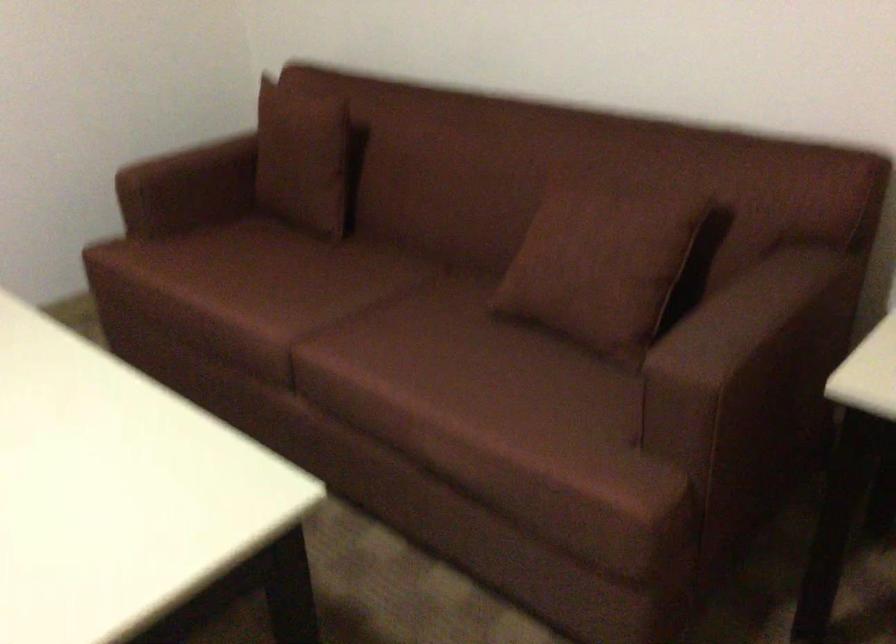
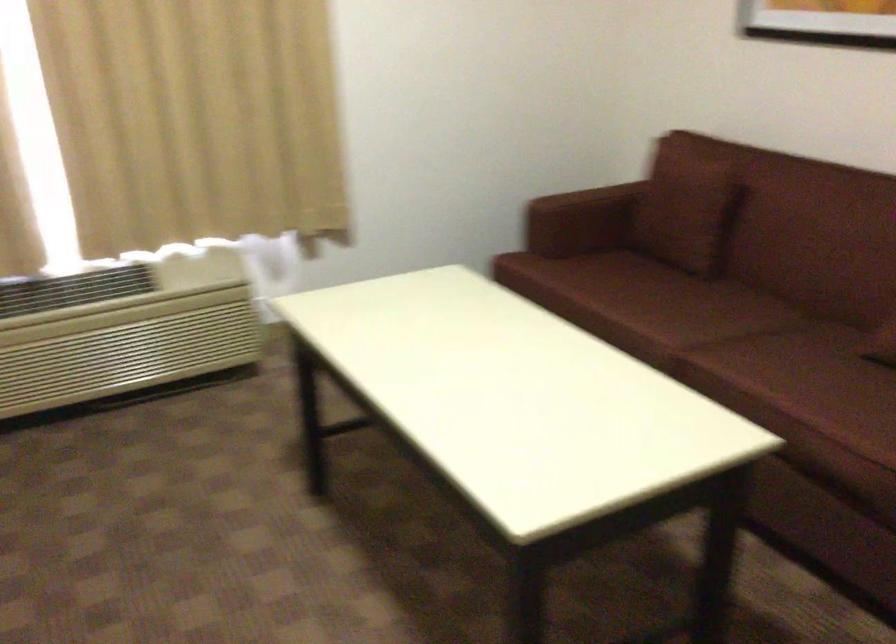
Question: How did the camera likely rotate?

Choices:
 (A) Left
 (B) Right
 (C) Up
 (D) Down

Answer: (A)